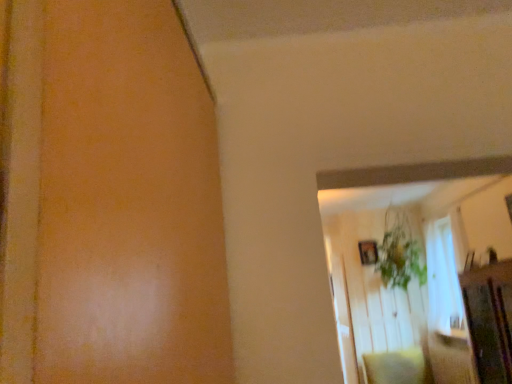
Question: Does wooden picture frame at upper right have a larger size compared to green leafy plant at upper center?

Choices:
 (A) yes
 (B) no

Answer: (B)

Question: Considering the relative positions of wooden picture frame at upper right and green leafy plant at upper center in the image provided, is wooden picture frame at upper right to the right of green leafy plant at upper center from the viewer's perspective?

Choices:
 (A) yes
 (B) no

Answer: (B)

Question: Is wooden picture frame at upper right positioned far away from green leafy plant at upper center?

Choices:
 (A) yes
 (B) no

Answer: (B)

Question: Can green leafy plant at upper center be found inside wooden picture frame at upper right?

Choices:
 (A) no
 (B) yes

Answer: (A)

Question: Can you confirm if wooden picture frame at upper right is positioned to the left of green leafy plant at upper center?

Choices:
 (A) yes
 (B) no

Answer: (A)

Question: In terms of height, does soft beige pillow at lower right look taller or shorter compared to green leafy plant at upper center?

Choices:
 (A) tall
 (B) short

Answer: (B)

Question: Would you say soft beige pillow at lower right is to the left or to the right of green leafy plant at upper center in the picture?

Choices:
 (A) left
 (B) right

Answer: (A)

Question: In the image, is soft beige pillow at lower right positioned in front of or behind green leafy plant at upper center?

Choices:
 (A) behind
 (B) front

Answer: (B)

Question: Is point (403, 357) positioned closer to the camera than point (404, 278)?

Choices:
 (A) farther
 (B) closer

Answer: (A)

Question: From a real-world perspective, is green leafy plant at upper center positioned above or below wooden picture frame at upper right?

Choices:
 (A) above
 (B) below

Answer: (A)

Question: From the image's perspective, relative to wooden picture frame at upper right, is green leafy plant at upper center above or below?

Choices:
 (A) below
 (B) above

Answer: (B)

Question: Is green leafy plant at upper center bigger or smaller than wooden picture frame at upper right?

Choices:
 (A) small
 (B) big

Answer: (B)

Question: In terms of height, does green leafy plant at upper center look taller or shorter compared to wooden picture frame at upper right?

Choices:
 (A) short
 (B) tall

Answer: (B)

Question: Based on their positions, is wooden picture frame at upper right located to the left or right of soft beige pillow at lower right?

Choices:
 (A) left
 (B) right

Answer: (A)

Question: Is wooden picture frame at upper right situated inside soft beige pillow at lower right or outside?

Choices:
 (A) inside
 (B) outside

Answer: (B)